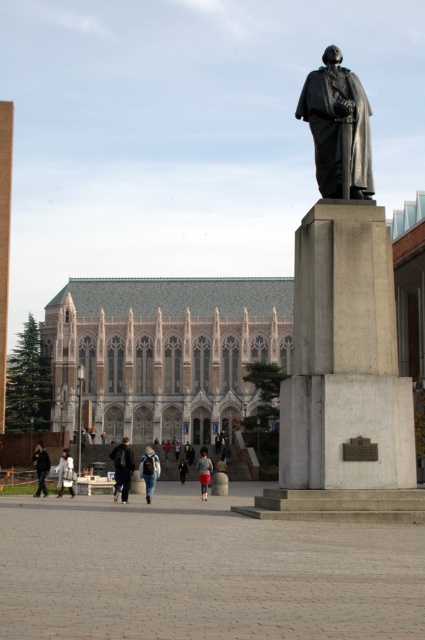
You are a photographer standing in the public square. You want to take a photo of the matte black statue at center and the dark gray jacket at lower left. Which object should you zoom in on to capture more details without moving closer?

You should zoom in on the matte black statue at center because it is thinner than the dark gray jacket at lower left, making it smaller and requiring more magnification to capture details.